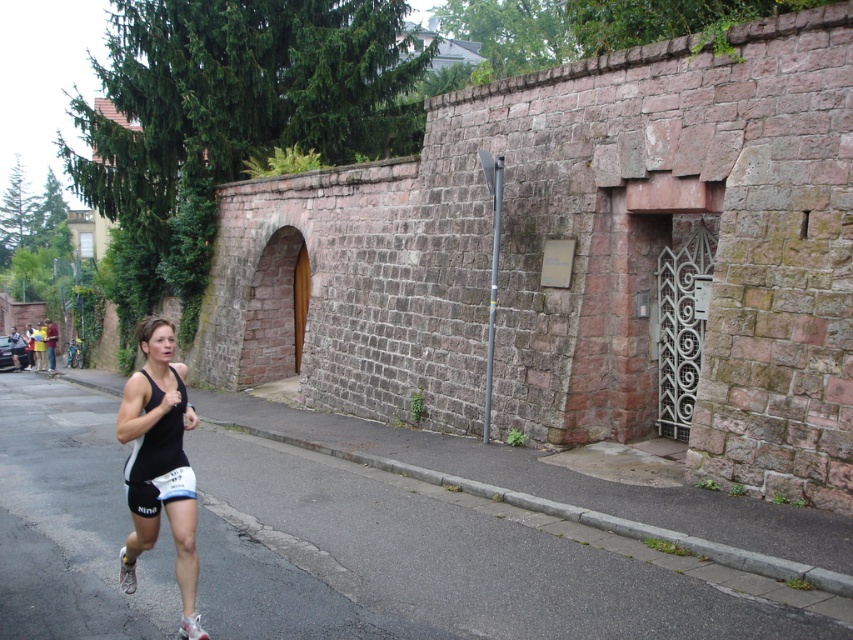
Based on the scene description, which object is positioned lower in the image, the black fabric runner at lower left or the black matte tank top at lower left?

The black fabric runner at lower left is located below the black matte tank top at lower left, so it is positioned lower in the image.

You are a photographer trying to capture the runner in the image. You need to decide which object to focus on first between the black fabric runner at lower left and the black matte tank top at lower left. Which one is wider?

The black fabric runner at lower left might be wider than black matte tank top at lower left, so you should focus on the black fabric runner at lower left first as it could occupy more of the frame.